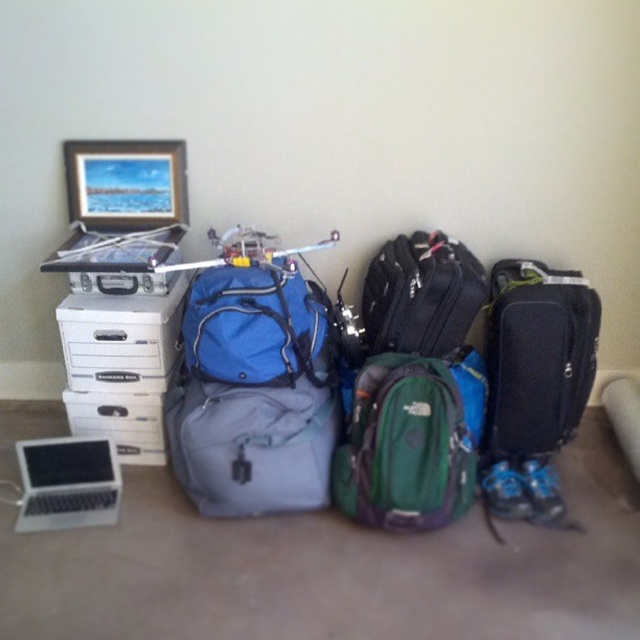
You are standing in front of the travel items and want to locate two specific points marked in the scene. The first point is at coordinates point (440, 305) and the second is at point (161, 225). Which of these two points is closer to you?

Point (440, 305) is in front of point (161, 225), so it is closer to you.

You need to pack your laptop into a bag that can accommodate its height. You see the black textured suitcase at right and the silver metallic laptop at lower left in the scene. Which object can fit the laptop based on their heights?

The black textured suitcase at right has a greater height compared to the silver metallic laptop at lower left, so the suitcase can accommodate the laptop.